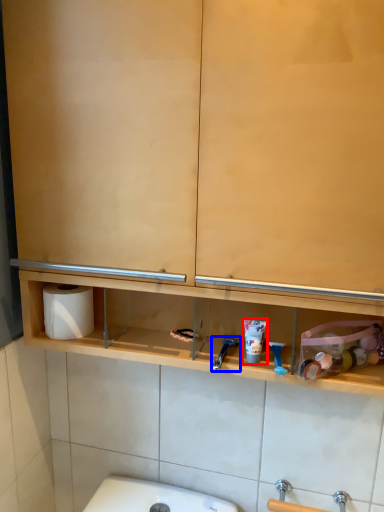
Question: Which point is closer to the camera, shaving cream (highlighted by a red box) or shower (highlighted by a blue box)?

Choices:
 (A) shaving cream
 (B) shower

Answer: (B)